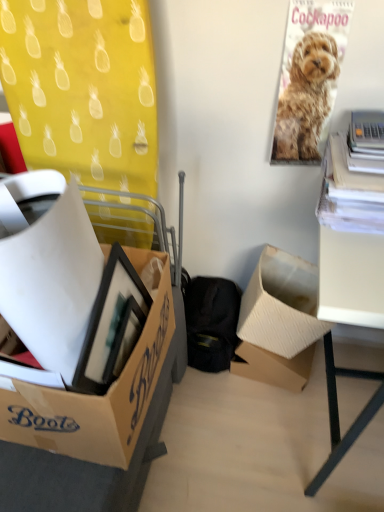
Question: In which direction should I rotate to look at cardboard box at center, arranged as the third box when viewed from the front?

Choices:
 (A) right
 (B) left

Answer: (A)

Question: Is white matte desk at right aimed at golden fur poster at upper right?

Choices:
 (A) yes
 (B) no

Answer: (B)

Question: Is white matte desk at right positioned in front of golden fur poster at upper right?

Choices:
 (A) yes
 (B) no

Answer: (A)

Question: Can you confirm if white matte desk at right is shorter than golden fur poster at upper right?

Choices:
 (A) yes
 (B) no

Answer: (B)

Question: Does white matte desk at right have a smaller size compared to golden fur poster at upper right?

Choices:
 (A) no
 (B) yes

Answer: (A)

Question: Considering the relative sizes of white matte desk at right and golden fur poster at upper right in the image provided, is white matte desk at right bigger than golden fur poster at upper right?

Choices:
 (A) yes
 (B) no

Answer: (A)

Question: Is white matte desk at right facing away from golden fur poster at upper right?

Choices:
 (A) yes
 (B) no

Answer: (B)

Question: From the image's perspective, is cardboard box at left, which is counted as the third box, starting from the back, above white matte desk at right?

Choices:
 (A) no
 (B) yes

Answer: (B)

Question: Is cardboard box at left, which is counted as the third box, starting from the back, shorter than white matte desk at right?

Choices:
 (A) yes
 (B) no

Answer: (A)

Question: Is cardboard box at left, which is counted as the third box, starting from the back, positioned with its back to white matte desk at right?

Choices:
 (A) yes
 (B) no

Answer: (B)

Question: Is cardboard box at left, which is the second box from front to back, far away from white matte desk at right?

Choices:
 (A) no
 (B) yes

Answer: (A)

Question: Considering the relative positions of cardboard box at left, which is counted as the third box, starting from the back, and white matte desk at right in the image provided, is cardboard box at left, which is counted as the third box, starting from the back, in front of white matte desk at right?

Choices:
 (A) yes
 (B) no

Answer: (A)

Question: Considering the relative sizes of cardboard box at left, which is counted as the third box, starting from the back, and white matte desk at right in the image provided, is cardboard box at left, which is counted as the third box, starting from the back, wider than white matte desk at right?

Choices:
 (A) yes
 (B) no

Answer: (B)

Question: From the image's perspective, is cardboard box at center, marked as the 2th box in a back-to-front arrangement, below white matte desk at right?

Choices:
 (A) yes
 (B) no

Answer: (B)